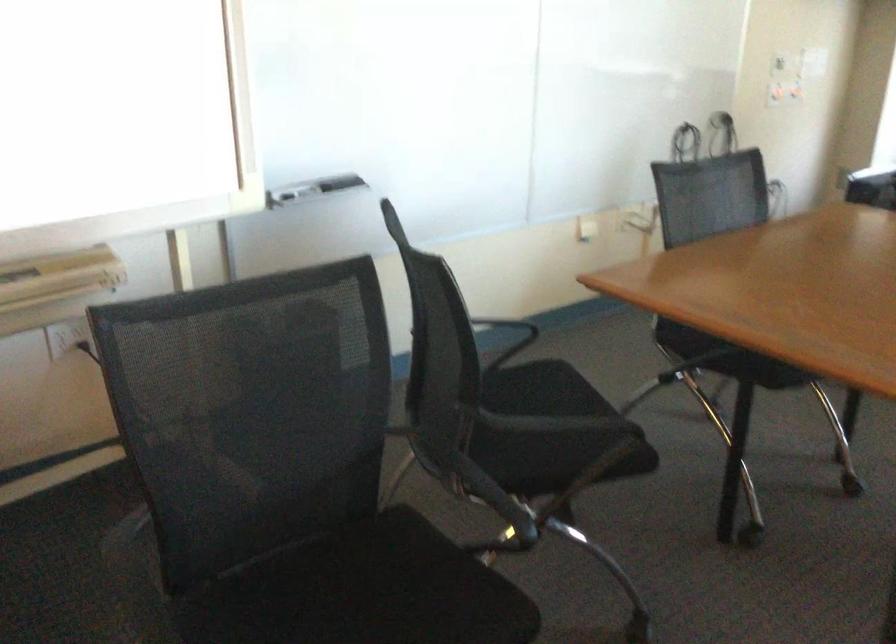
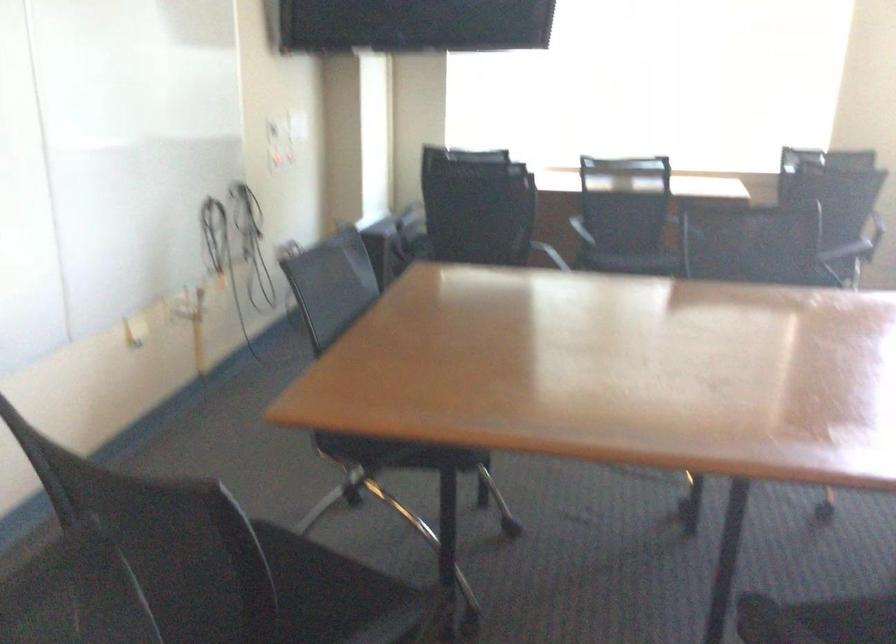
The point at [583,415] is marked in the first image. Where is the corresponding point in the second image?

(331, 592)